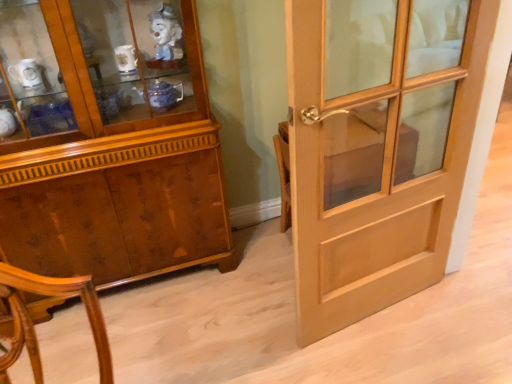
Find the location of a particular element. This screenshot has height=384, width=512. light brown wood door at right is located at coordinates pyautogui.click(x=377, y=154).

This screenshot has height=384, width=512. What do you see at coordinates (377, 154) in the screenshot?
I see `light brown wood door at right` at bounding box center [377, 154].

Measure the distance between light brown wood door at right and camera.

A distance of 1.05 meters exists between light brown wood door at right and camera.

Locate an element on the screen. Image resolution: width=512 pixels, height=384 pixels. wooden cabinet at left is located at coordinates (112, 144).

This screenshot has height=384, width=512. Describe the element at coordinates (112, 144) in the screenshot. I see `wooden cabinet at left` at that location.

Find the location of a particular element. light brown wood door at right is located at coordinates (377, 154).

Considering the positions of objects light brown wood door at right and wooden cabinet at left in the image provided, who is more to the right, light brown wood door at right or wooden cabinet at left?

light brown wood door at right.

Is the position of light brown wood door at right more distant than that of wooden cabinet at left?

No, it is in front of wooden cabinet at left.

Considering the points (402, 140) and (56, 237), which point is in front, point (402, 140) or point (56, 237)?

The point (56, 237) is closer to the camera.

From the image's perspective, does light brown wood door at right appear higher than wooden cabinet at left?

No, from the image's perspective, light brown wood door at right is not above wooden cabinet at left.

From a real-world perspective, is light brown wood door at right beneath wooden cabinet at left?

Yes.

Between light brown wood door at right and wooden cabinet at left, which one has larger width?

wooden cabinet at left.

Is light brown wood door at right taller or shorter than wooden cabinet at left?

Considering their sizes, light brown wood door at right has less height than wooden cabinet at left.

Can you confirm if light brown wood door at right is bigger than wooden cabinet at left?

Incorrect, light brown wood door at right is not larger than wooden cabinet at left.

Would you say light brown wood door at right contains wooden cabinet at left?

Actually, wooden cabinet at left is outside light brown wood door at right.

Is light brown wood door at right beside wooden cabinet at left?

light brown wood door at right and wooden cabinet at left are not in contact.

Consider the image. Is light brown wood door at right facing away from wooden cabinet at left?

No, wooden cabinet at left is not at the back of light brown wood door at right.

How distant is light brown wood door at right from wooden cabinet at left?

light brown wood door at right and wooden cabinet at left are 32.02 inches apart.

This screenshot has width=512, height=384. Find the location of `cabinetry that appears behind the light brown wood door at right`. cabinetry that appears behind the light brown wood door at right is located at coordinates (112, 144).

Considering the relative positions of wooden cabinet at left and light brown wood door at right in the image provided, is wooden cabinet at left to the left of light brown wood door at right from the viewer's perspective?

Correct, you'll find wooden cabinet at left to the left of light brown wood door at right.

In the scene shown: Which object is further away from the camera taking this photo, wooden cabinet at left or light brown wood door at right?

Positioned behind is wooden cabinet at left.

Which is further, (91, 129) or (311, 88)?

Point (91, 129)

Consider the image. From the image's perspective, is wooden cabinet at left above light brown wood door at right?

Indeed, from the image's perspective, wooden cabinet at left is shown above light brown wood door at right.

From a real-world perspective, who is located higher, wooden cabinet at left or light brown wood door at right?

In real-world perspective, wooden cabinet at left is above.

Between wooden cabinet at left and light brown wood door at right, which one has larger width?

With larger width is wooden cabinet at left.

Considering the sizes of objects wooden cabinet at left and light brown wood door at right in the image provided, who is taller, wooden cabinet at left or light brown wood door at right?

wooden cabinet at left is taller.

Considering the relative sizes of wooden cabinet at left and light brown wood door at right in the image provided, is wooden cabinet at left bigger than light brown wood door at right?

Yes.

From the picture: Is wooden cabinet at left not within light brown wood door at right?

wooden cabinet at left is positioned outside light brown wood door at right.

Is wooden cabinet at left with light brown wood door at right?

wooden cabinet at left is not next to light brown wood door at right, and they're not touching.

Is light brown wood door at right at the back of wooden cabinet at left?

No, wooden cabinet at left's orientation is not away from light brown wood door at right.

What's the angular difference between wooden cabinet at left and light brown wood door at right's facing directions?

The facing directions of wooden cabinet at left and light brown wood door at right are 8.14 degrees apart.

The height and width of the screenshot is (384, 512). In order to click on cabinetry lying above the light brown wood door at right (from the image's perspective) in this screenshot , I will do `click(112, 144)`.

At what (x,y) coordinates should I click in order to perform the action: click on door lying in front of the wooden cabinet at left. Please return your answer as a coordinate pair (x, y). The image size is (512, 384). Looking at the image, I should click on pyautogui.click(x=377, y=154).

Find the location of a particular element. cabinetry to the left of light brown wood door at right is located at coordinates (112, 144).